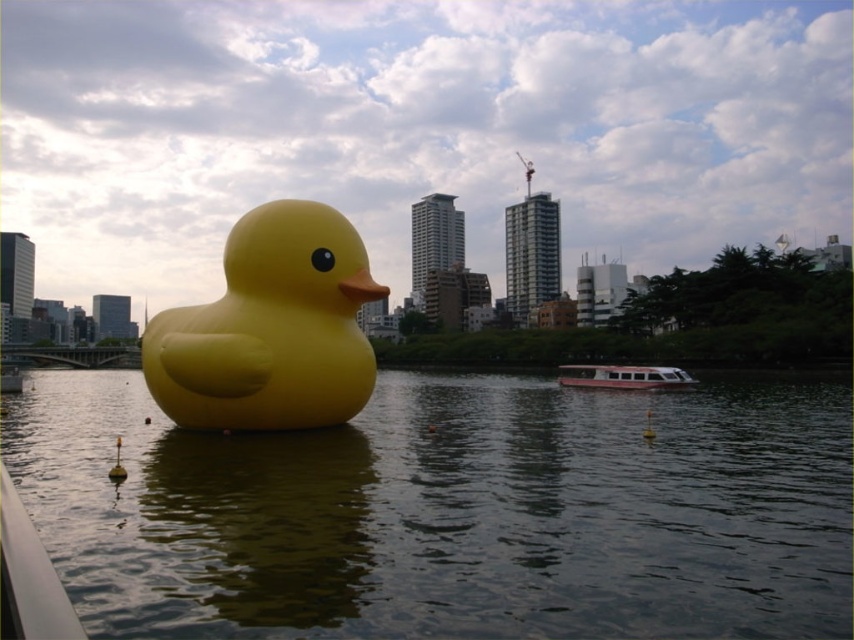
Consider the image. You are a boat captain navigating a small vessel and you need to pass through the area between the smooth water at center and the yellow matte rubber duck at center. Your boat requires a minimum of 15 feet of clearance to safely navigate. Can you safely pass through this area?

The distance between the smooth water at center and the yellow matte rubber duck at center is 17.87 feet, which is greater than the boat requires 15 feet of clearance. Therefore, you can safely pass through this area.

You are a photographer trying to capture the yellow matte rubber duck at center and the white glossy boat at center in the same frame. Based on their positions, which one would appear closer to the camera in the photo?

The yellow matte rubber duck at center appears closer to the camera because it is located above the white glossy boat at center, indicating it is positioned in the foreground.

You are a photographer trying to capture the smooth water at center and the white glossy boat at center in a single shot. Which object will appear closer to the camera in the photo?

The smooth water at center will appear closer to the camera because it is not as tall as the white glossy boat at center, making the boat appear further back in the photo.